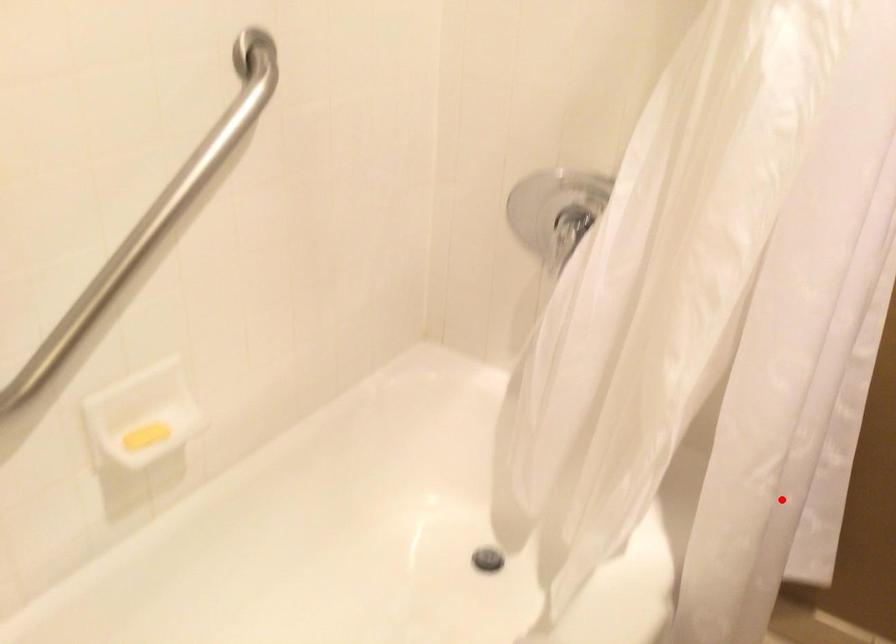
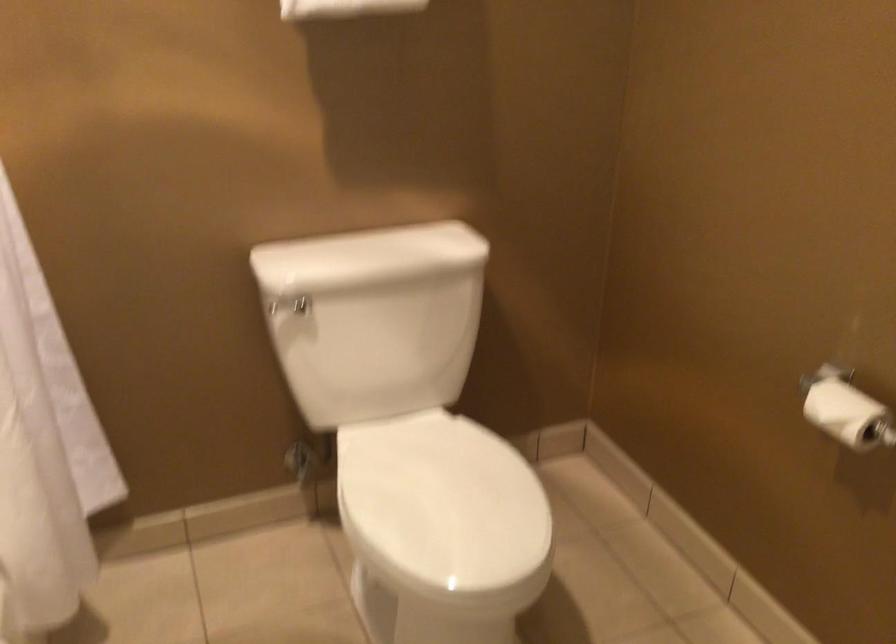
Find the pixel in the second image that matches the highlighted location in the first image.

(44, 444)